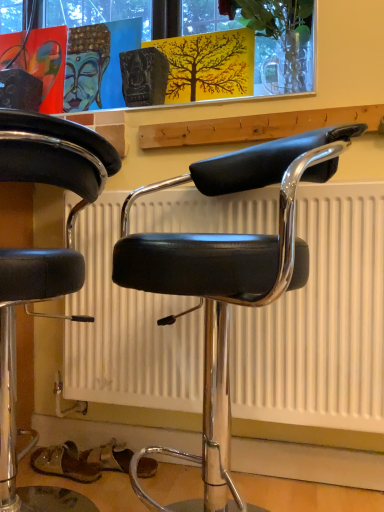
Question: Does black leather stool at left, marked as the 1th chair in a left-to-right arrangement, have a greater height compared to black leather chair at center, which is the 1th chair from right to left?

Choices:
 (A) no
 (B) yes

Answer: (B)

Question: Is black leather stool at left, marked as the 1th chair in a left-to-right arrangement, positioned beyond the bounds of black leather chair at center, which is counted as the 2th chair, starting from the left?

Choices:
 (A) no
 (B) yes

Answer: (B)

Question: From a real-world perspective, is black leather stool at left, which is counted as the 2th chair, starting from the right, over black leather chair at center, which is the 1th chair from right to left?

Choices:
 (A) yes
 (B) no

Answer: (B)

Question: From the image's perspective, is black leather stool at left, which is counted as the 2th chair, starting from the right, over black leather chair at center, which is the 1th chair from right to left?

Choices:
 (A) no
 (B) yes

Answer: (A)

Question: Could you tell me if black leather stool at left, marked as the 1th chair in a left-to-right arrangement, is turned towards black leather chair at center, which is the 1th chair from right to left?

Choices:
 (A) yes
 (B) no

Answer: (B)

Question: Considering the relative positions of black leather stool at left, which is counted as the 2th chair, starting from the right, and black leather chair at center, which is counted as the 2th chair, starting from the left, in the image provided, is black leather stool at left, which is counted as the 2th chair, starting from the right, to the left of black leather chair at center, which is counted as the 2th chair, starting from the left, from the viewer's perspective?

Choices:
 (A) yes
 (B) no

Answer: (A)

Question: Considering the relative positions of black leather chair at center, which is counted as the 2th chair, starting from the left, and translucent glass vase at upper center in the image provided, is black leather chair at center, which is counted as the 2th chair, starting from the left, behind translucent glass vase at upper center?

Choices:
 (A) no
 (B) yes

Answer: (A)

Question: Is black leather chair at center, which is the 1th chair from right to left, touching translucent glass vase at upper center?

Choices:
 (A) no
 (B) yes

Answer: (A)

Question: Considering the relative sizes of black leather chair at center, which is counted as the 2th chair, starting from the left, and translucent glass vase at upper center in the image provided, is black leather chair at center, which is counted as the 2th chair, starting from the left, shorter than translucent glass vase at upper center?

Choices:
 (A) no
 (B) yes

Answer: (A)

Question: Considering the relative sizes of black leather chair at center, which is counted as the 2th chair, starting from the left, and translucent glass vase at upper center in the image provided, is black leather chair at center, which is counted as the 2th chair, starting from the left, bigger than translucent glass vase at upper center?

Choices:
 (A) no
 (B) yes

Answer: (B)

Question: Does black leather chair at center, which is the 1th chair from right to left, come in front of translucent glass vase at upper center?

Choices:
 (A) no
 (B) yes

Answer: (B)

Question: Can you confirm if black leather chair at center, which is the 1th chair from right to left, is taller than translucent glass vase at upper center?

Choices:
 (A) no
 (B) yes

Answer: (B)

Question: From the image's perspective, does translucent glass vase at upper center appear lower than black leather chair at center, which is counted as the 2th chair, starting from the left?

Choices:
 (A) no
 (B) yes

Answer: (A)